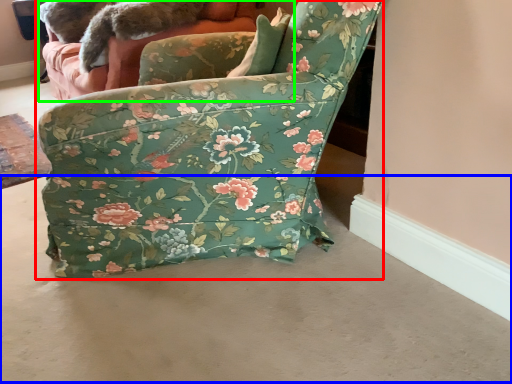
Question: Considering the real-world distances, which object is closest to chair (highlighted by a red box)? concrete (highlighted by a blue box) or couch (highlighted by a green box).

Choices:
 (A) concrete
 (B) couch

Answer: (A)